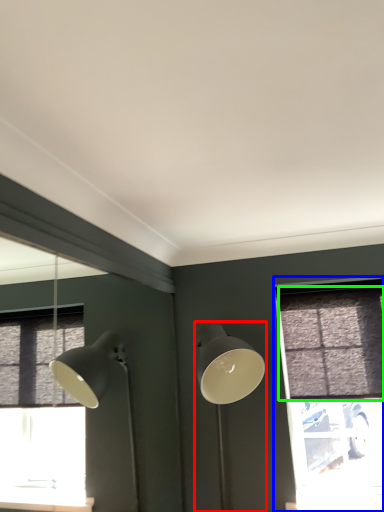
Question: Estimate the real-world distances between objects in this image. Which object is farther from lamp (highlighted by a red box), window (highlighted by a blue box) or curtain (highlighted by a green box)?

Choices:
 (A) window
 (B) curtain

Answer: (A)